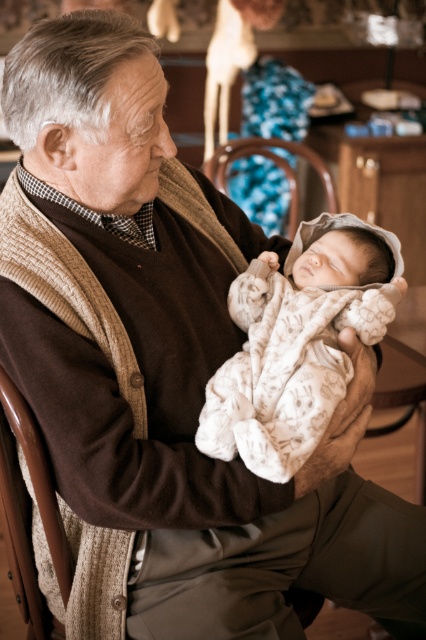
You are a photographer taking a picture of the elderly man and the newborn baby. The camera you are using has a focus point at point (298, 342). Which object is at that focus point?

The white soft fabric newborn at center is located at point (298, 342).

You are a photographer taking a picture of the elderly man and the baby. You notice two points in the image at coordinates point (250,278) and point (302,150). Which point is closer to your camera?

Point (250,278) is closer to the camera than point (302,150).